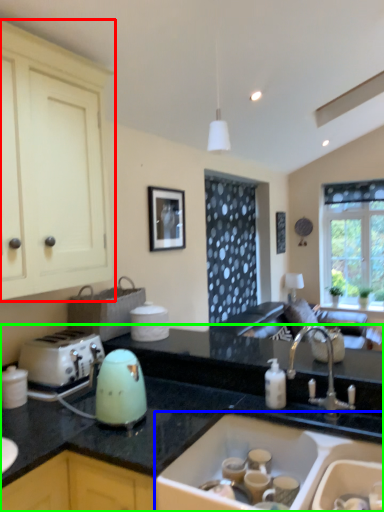
Question: Estimate the real-world distances between objects in this image. Which object is closer to cabinetry (highlighted by a red box), sink (highlighted by a blue box) or countertop (highlighted by a green box)?

Choices:
 (A) sink
 (B) countertop

Answer: (B)